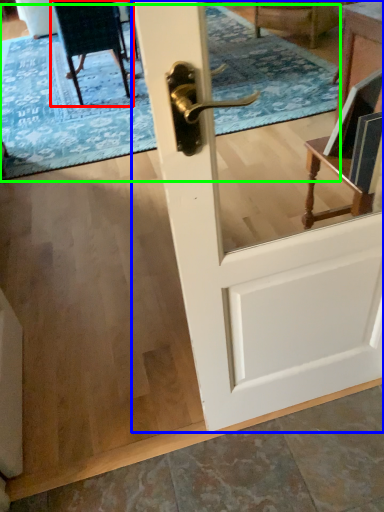
Question: Considering the real-world distances, which object is closest to chair (highlighted by a red box)? door (highlighted by a blue box) or doormat (highlighted by a green box).

Choices:
 (A) door
 (B) doormat

Answer: (B)